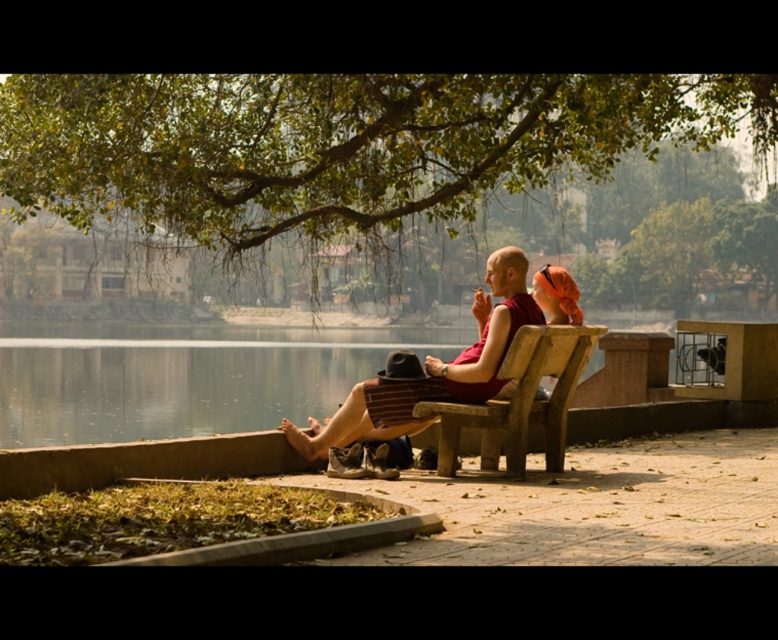
Can you confirm if green leafy tree at upper center is positioned below matte orange headscarf at center?

Actually, green leafy tree at upper center is above matte orange headscarf at center.

Who is higher up, green leafy tree at upper center or matte orange headscarf at center?

green leafy tree at upper center is higher up.

Is point (81, 179) positioned behind point (547, 308)?

Yes, point (81, 179) is farther from viewer.

The height and width of the screenshot is (640, 778). In order to click on green leafy tree at upper center in this screenshot , I will do `click(335, 141)`.

Does matte red monk's robe at center have a smaller size compared to wooden park bench at center?

No.

Does matte red monk's robe at center appear over wooden park bench at center?

Yes.

Where is `matte red monk's robe at center`? matte red monk's robe at center is located at coordinates (433, 369).

Does point (598, 330) come farther from viewer compared to point (580, 308)?

No, (598, 330) is in front of (580, 308).

Can you confirm if wooden park bench at center is taller than matte orange headscarf at center?

Correct, wooden park bench at center is much taller as matte orange headscarf at center.

Measure the distance between point (556,461) and camera.

They are 38.98 feet apart.

I want to click on wooden park bench at center, so click(519, 401).